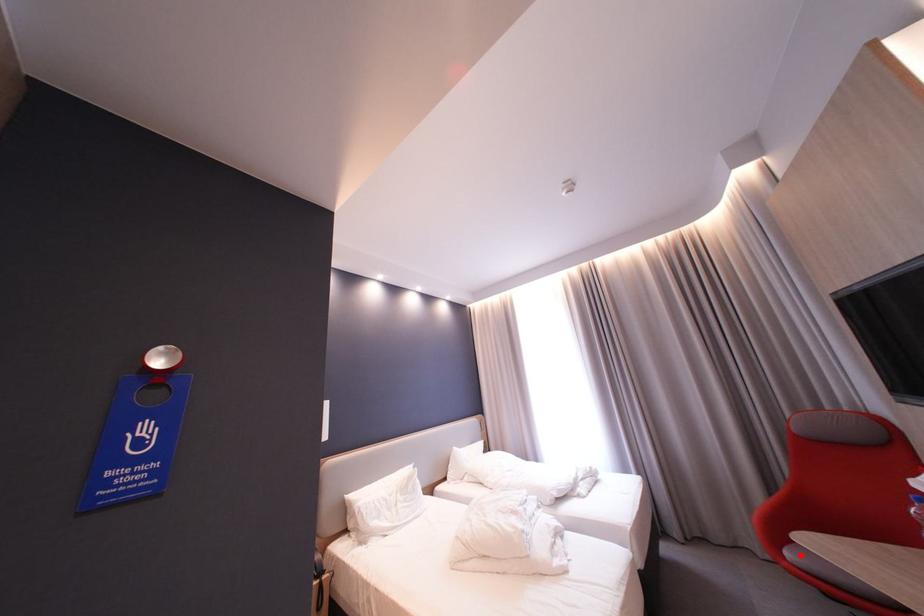
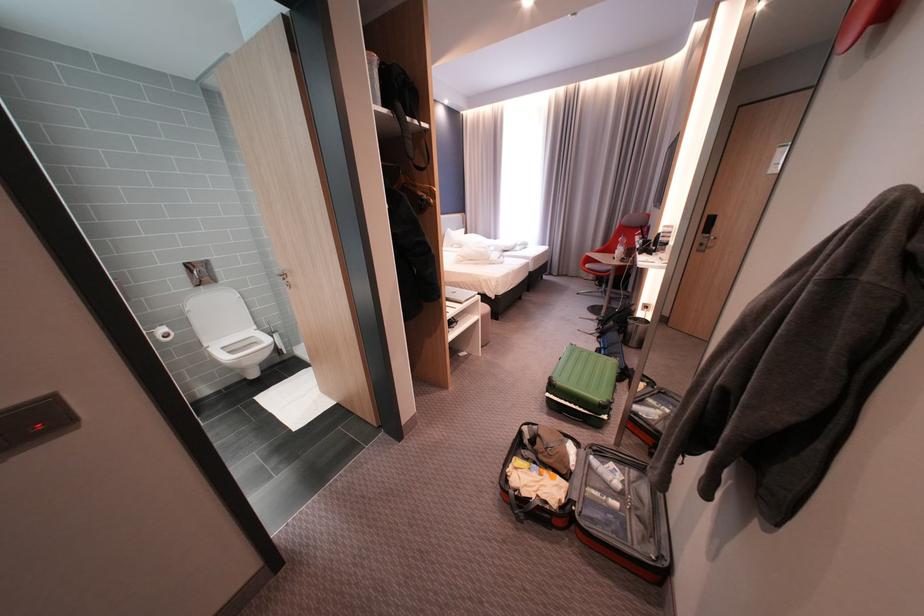
Question: I am providing you with two images of the same scene from different viewpoints. A red point is shown in image1. For the corresponding object point in image2, is it positioned nearer or farther from the camera?

Choices:
 (A) Nearer
 (B) Farther

Answer: (A)